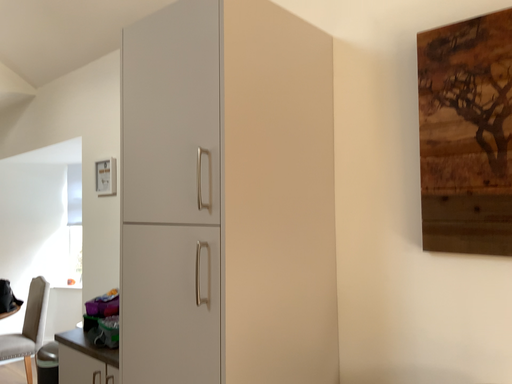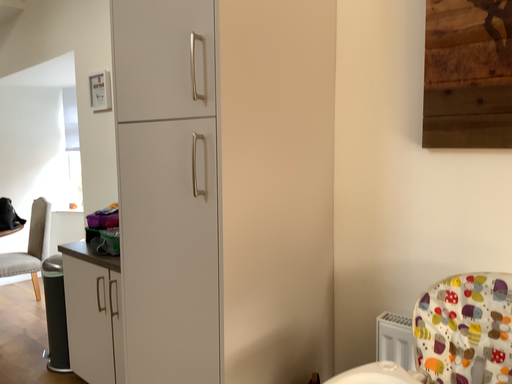
Question: How did the camera likely rotate when shooting the video?

Choices:
 (A) rotated upward
 (B) rotated downward

Answer: (B)